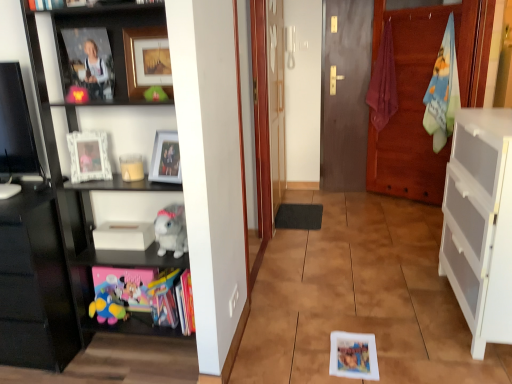
Question: Should I look upward or downward to see gray plush toy at left?

Choices:
 (A) up
 (B) down

Answer: (B)

Question: Is matte glass picture frame at upper center, the 1th picture frame in the bottom-to-top sequence, inside black glossy shelf at left?

Choices:
 (A) no
 (B) yes

Answer: (B)

Question: From the image's perspective, is black glossy shelf at left under matte glass picture frame at upper center, the 1th picture frame in the bottom-to-top sequence?

Choices:
 (A) no
 (B) yes

Answer: (B)

Question: From a real-world perspective, is black glossy shelf at left positioned under matte glass picture frame at upper center, the 1th picture frame in the bottom-to-top sequence, based on gravity?

Choices:
 (A) yes
 (B) no

Answer: (A)

Question: Is black glossy shelf at left looking in the opposite direction of matte glass picture frame at upper center, positioned as the 3th picture frame in top-to-bottom order?

Choices:
 (A) no
 (B) yes

Answer: (B)

Question: Does black glossy shelf at left lie in front of matte glass picture frame at upper center, the 1th picture frame in the bottom-to-top sequence?

Choices:
 (A) yes
 (B) no

Answer: (A)

Question: Would you say black glossy shelf at left is outside matte glass picture frame at upper center, positioned as the 3th picture frame in top-to-bottom order?

Choices:
 (A) no
 (B) yes

Answer: (B)

Question: Is black glossy shelf at left outside of soft plush toy at lower left, which is the 1th toy in back-to-front order?

Choices:
 (A) yes
 (B) no

Answer: (A)

Question: Does black glossy shelf at left lie in front of soft plush toy at lower left, the 1th toy viewed from the left?

Choices:
 (A) yes
 (B) no

Answer: (A)

Question: Does black glossy shelf at left appear on the left side of soft plush toy at lower left, the first toy ordered from the bottom?

Choices:
 (A) no
 (B) yes

Answer: (A)

Question: Could soft plush toy at lower left, the first toy ordered from the bottom, be considered to be inside black glossy shelf at left?

Choices:
 (A) yes
 (B) no

Answer: (A)

Question: Are black glossy shelf at left and soft plush toy at lower left, which ranks as the second toy in right-to-left order, located far from each other?

Choices:
 (A) yes
 (B) no

Answer: (B)

Question: From the image's perspective, is black glossy shelf at left on top of soft plush toy at lower left, which ranks as the second toy in right-to-left order?

Choices:
 (A) yes
 (B) no

Answer: (A)

Question: Can you confirm if soft plush toy at lower left, which is the 1th toy in back-to-front order, is taller than gray plush toy at left?

Choices:
 (A) yes
 (B) no

Answer: (B)